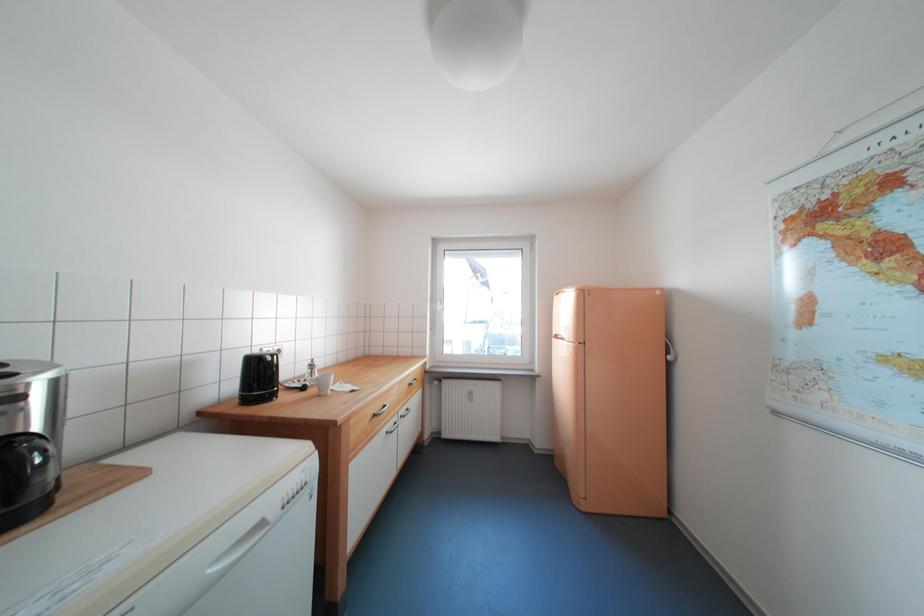
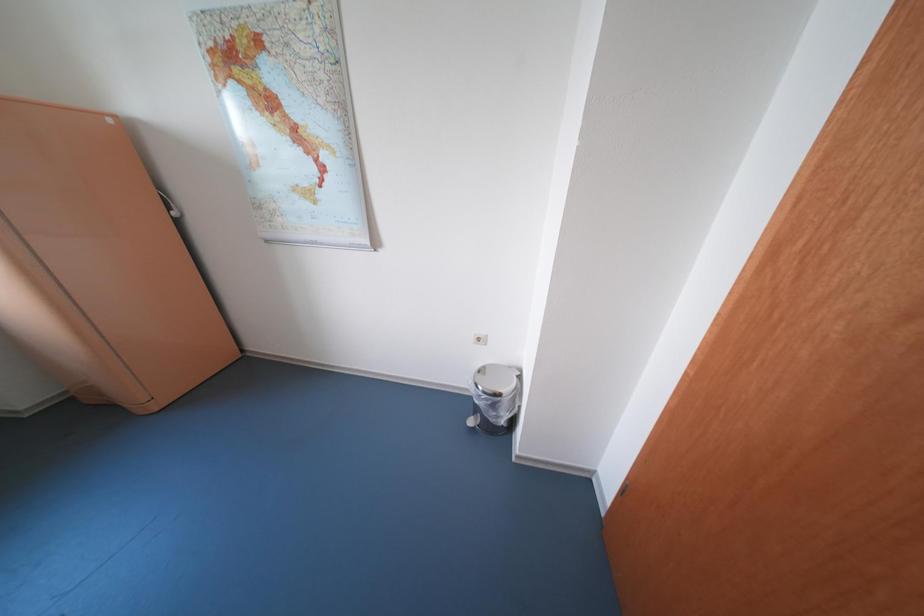
Based on the continuous images, in which direction is the camera rotating?

The camera's rotation is toward right-down.